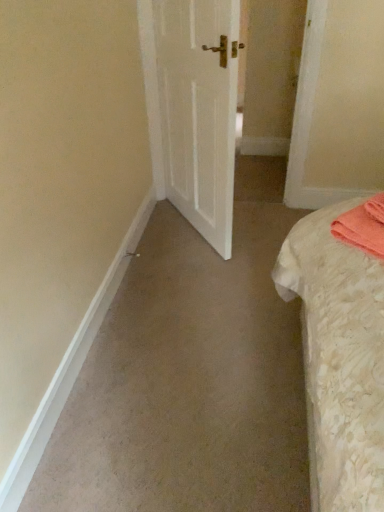
What do you see at coordinates (199, 110) in the screenshot? I see `white matte door at center` at bounding box center [199, 110].

Measure the distance between white matte door at center and camera.

They are 1.55 meters apart.

In order to face white matte door at center, should I rotate leftwards or rightwards?

It's best to rotate right around 1.006 degrees.

This screenshot has height=512, width=384. I want to click on white matte door at center, so click(x=199, y=110).

Identify the location of white matte door at center. Image resolution: width=384 pixels, height=512 pixels. (199, 110).